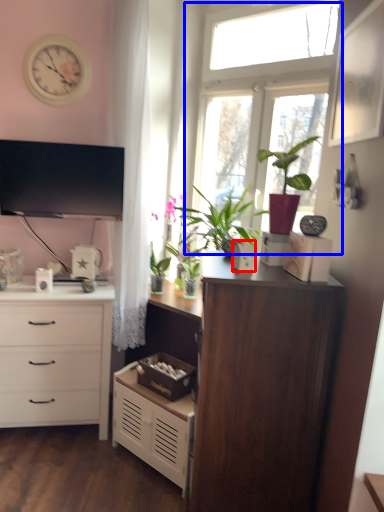
Question: Which point is closer to the camera, appliance (highlighted by a red box) or window (highlighted by a blue box)?

Choices:
 (A) appliance
 (B) window

Answer: (A)